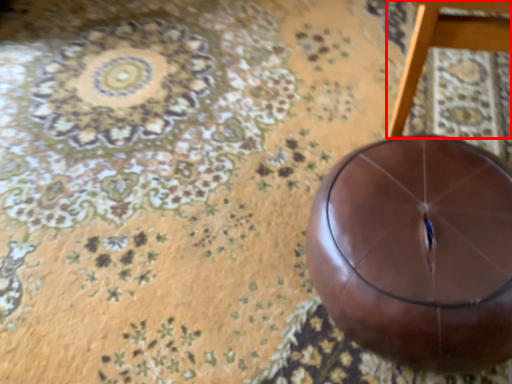
Question: From the image's perspective, considering the relative positions of furniture (annotated by the red box) and ball in the image provided, where is furniture (annotated by the red box) located with respect to the staircase?

Choices:
 (A) above
 (B) below

Answer: (A)